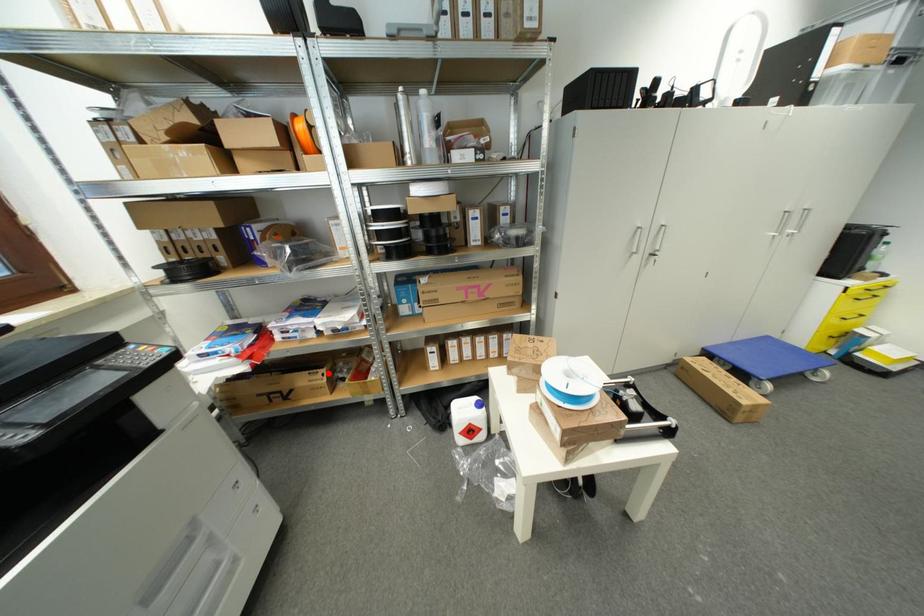
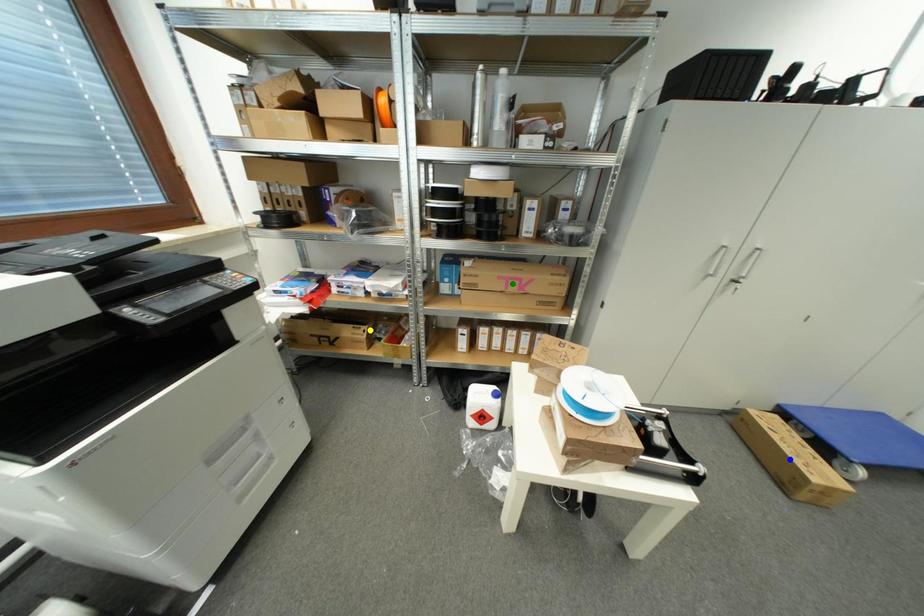
Question: I am providing you with two images of the same scene from different viewpoints. A red point is marked on the first image. You are given multiple points on the second image. Which spot in image 2 lines up with the point in image 1?

Choices:
 (A) blue point
 (B) yellow point
 (C) green point

Answer: (B)